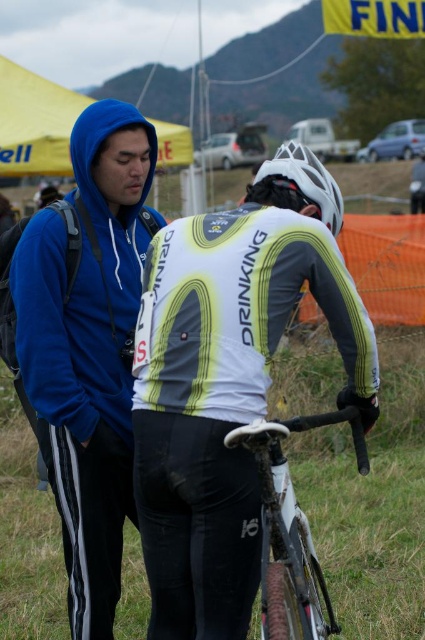
You are a photographer positioned at the center of the scene. You want to capture a photo that includes both the blue fleece jacket at left and the white matte bicycle helmet at center. What is the minimum distance you need to move backward to ensure both subjects are in frame?

The blue fleece jacket at left and white matte bicycle helmet at center are 4.02 feet apart. To include both in the frame, you need to move backward until your camera can capture a width of at least 4.02 feet. The exact distance depends on your camera lens, but moving back a few feet should suffice.

You are standing at the starting line of the cycling event and see two points marked on the track ahead. The first point is at coordinates point [331,198] and the second is at point [272,602]. Which point is closer to you?

Point [272,602] is closer to you because it is nearer to the camera compared to point [331,198], which is further away.

You are a photographer trying to capture a photo of the two bicycles in the image. You want to ensure that both the white matte bicycle at center and the white matte bicycle handlebars at center are clearly visible in your shot. Based on their positions, which one should you focus on first to ensure the bicycle is fully in frame?

The white matte bicycle at center is positioned on the left side of the white matte bicycle handlebars at center, so focusing on the white matte bicycle at center first will ensure the entire bicycle including its handlebars is captured in the frame.